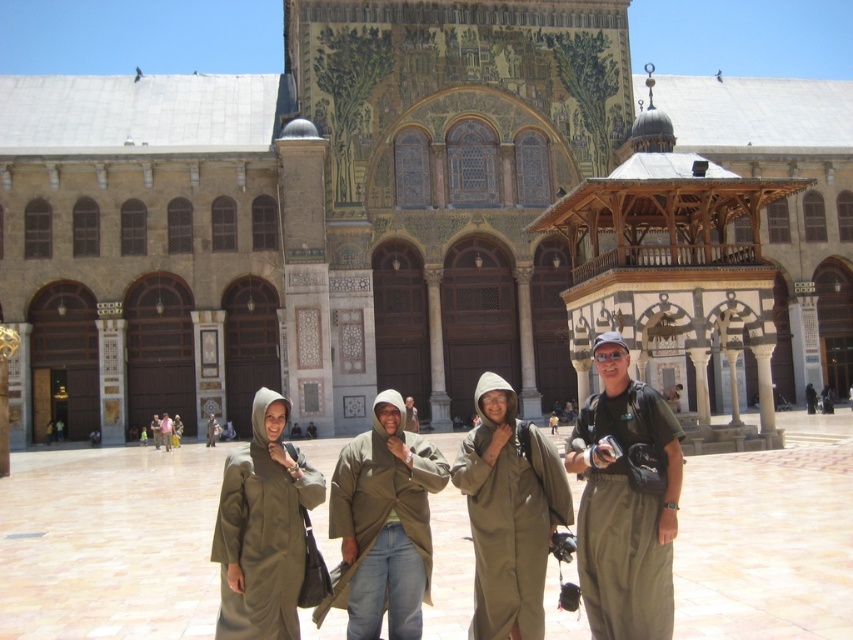
Which of these two, green fabric jacket at center or khaki fabric jacket at center, stands shorter?

khaki fabric jacket at center is shorter.

Does point (413, 422) lie in front of point (212, 442)?

Yes, point (413, 422) is closer to viewer.

Does point (416, 426) lie in front of point (206, 429)?

Yes, it is in front of point (206, 429).

I want to click on green fabric jacket at center, so click(x=410, y=416).

Which of these two, olive-green fabric jacket at center or khaki fabric jacket at center, stands taller?

olive-green fabric jacket at center is taller.

Is point (416, 513) positioned behind point (218, 435)?

No, it is in front of (218, 435).

You are a GUI agent. You are given a task and a screenshot of the screen. Output one action in this format:
    pyautogui.click(x=<x>, y=<y>)
    Task: Click on the olive-green fabric jacket at center
    
    Given the screenshot: What is the action you would take?
    pyautogui.click(x=383, y=524)

Is point (363, 550) positioned after point (270, 570)?

Yes, it is behind point (270, 570).

Which is behind, point (428, 547) or point (287, 506)?

Point (287, 506)

Identify the location of olive-green fabric jacket at center. (383, 524).